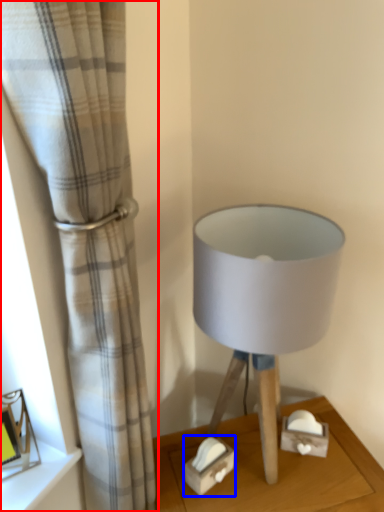
Question: Among these objects, which one is farthest to the camera, curtain (highlighted by a red box) or box (highlighted by a blue box)?

Choices:
 (A) curtain
 (B) box

Answer: (B)